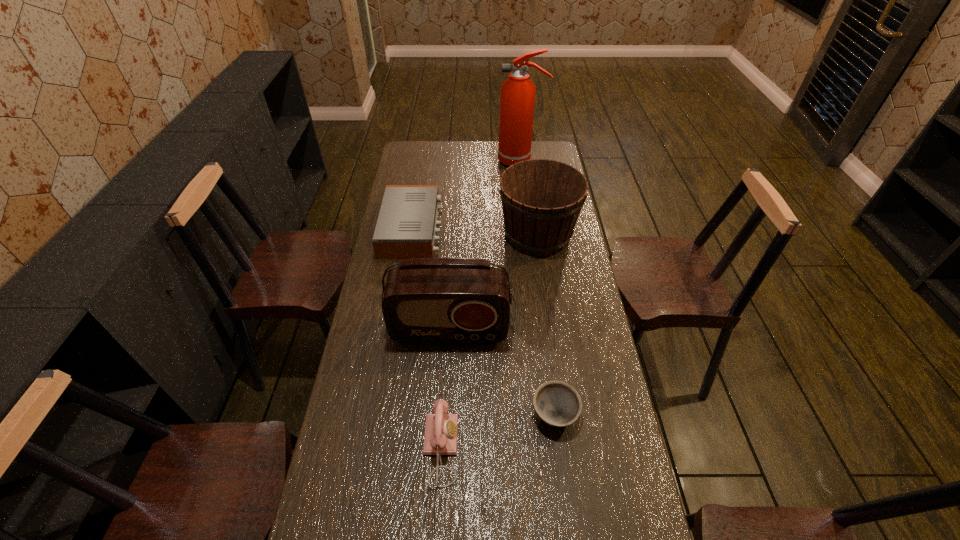
Where is `bowl located at the right edge`? The width and height of the screenshot is (960, 540). bowl located at the right edge is located at coordinates (558, 404).

Where is `object positioned at the far right corner`? object positioned at the far right corner is located at coordinates (517, 102).

The image size is (960, 540). In order to click on vacant region at the far edge of the desktop in this screenshot , I will do pos(451,150).

Where is `vacant space at the left edge`? The image size is (960, 540). vacant space at the left edge is located at coordinates (378, 508).

What are the coordinates of `free space at the right edge` in the screenshot? It's located at (632, 478).

Image resolution: width=960 pixels, height=540 pixels. What are the coordinates of `empty location between the second shortest object and the wine bucket` in the screenshot? It's located at (475, 232).

This screenshot has height=540, width=960. Identify the location of vacant area between the fire extinguisher and the taller radio receiver. (485, 245).

Locate which object ranks fourth in proximity to the telephone. Please provide its 2D coordinates. Your answer should be formatted as a tuple, i.e. [(x, y)], where the tuple contains the x and y coordinates of a point satisfying the conditions above.

[(406, 228)]

Select which object is the second closest to the tallest object. Please provide its 2D coordinates. Your answer should be formatted as a tuple, i.e. [(x, y)], where the tuple contains the x and y coordinates of a point satisfying the conditions above.

[(406, 228)]

Where is `free space that satisfies the following two spatial constraints: 1. at the nozzle of the wine bucket; 2. on the left side of the tallest object`? The image size is (960, 540). free space that satisfies the following two spatial constraints: 1. at the nozzle of the wine bucket; 2. on the left side of the tallest object is located at coordinates (530, 234).